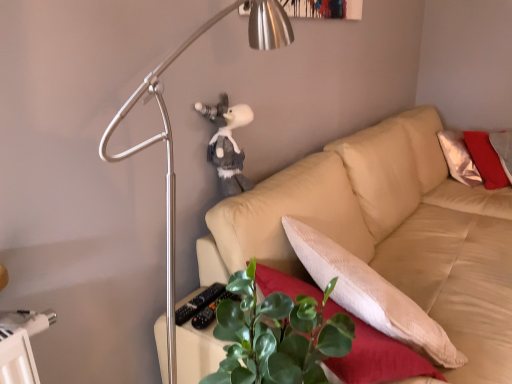
Question: Considering the relative sizes of metallic silver lamp at upper left and white plush toy at upper center in the image provided, is metallic silver lamp at upper left smaller than white plush toy at upper center?

Choices:
 (A) yes
 (B) no

Answer: (B)

Question: Considering the relative sizes of metallic silver lamp at upper left and white plush toy at upper center in the image provided, is metallic silver lamp at upper left thinner than white plush toy at upper center?

Choices:
 (A) no
 (B) yes

Answer: (A)

Question: Can you confirm if metallic silver lamp at upper left is taller than white plush toy at upper center?

Choices:
 (A) no
 (B) yes

Answer: (B)

Question: Is metallic silver lamp at upper left shorter than white plush toy at upper center?

Choices:
 (A) yes
 (B) no

Answer: (B)

Question: Can you confirm if metallic silver lamp at upper left is positioned to the left of white plush toy at upper center?

Choices:
 (A) no
 (B) yes

Answer: (A)

Question: From a real-world perspective, is metallic silver lamp at upper left beneath white plush toy at upper center?

Choices:
 (A) no
 (B) yes

Answer: (B)

Question: Considering the relative positions of white plush toy at upper center and green leafy plant at lower center in the image provided, is white plush toy at upper center behind green leafy plant at lower center?

Choices:
 (A) no
 (B) yes

Answer: (B)

Question: Is green leafy plant at lower center completely or partially inside white plush toy at upper center?

Choices:
 (A) yes
 (B) no

Answer: (B)

Question: Is the position of white plush toy at upper center less distant than that of green leafy plant at lower center?

Choices:
 (A) no
 (B) yes

Answer: (A)

Question: Does white plush toy at upper center appear on the left side of green leafy plant at lower center?

Choices:
 (A) no
 (B) yes

Answer: (B)

Question: Is white plush toy at upper center not near green leafy plant at lower center?

Choices:
 (A) yes
 (B) no

Answer: (B)

Question: From the image's perspective, is white plush toy at upper center located above green leafy plant at lower center?

Choices:
 (A) yes
 (B) no

Answer: (A)

Question: Is beige fabric couch at center closer to the viewer compared to metallic silver lamp at upper left?

Choices:
 (A) yes
 (B) no

Answer: (B)